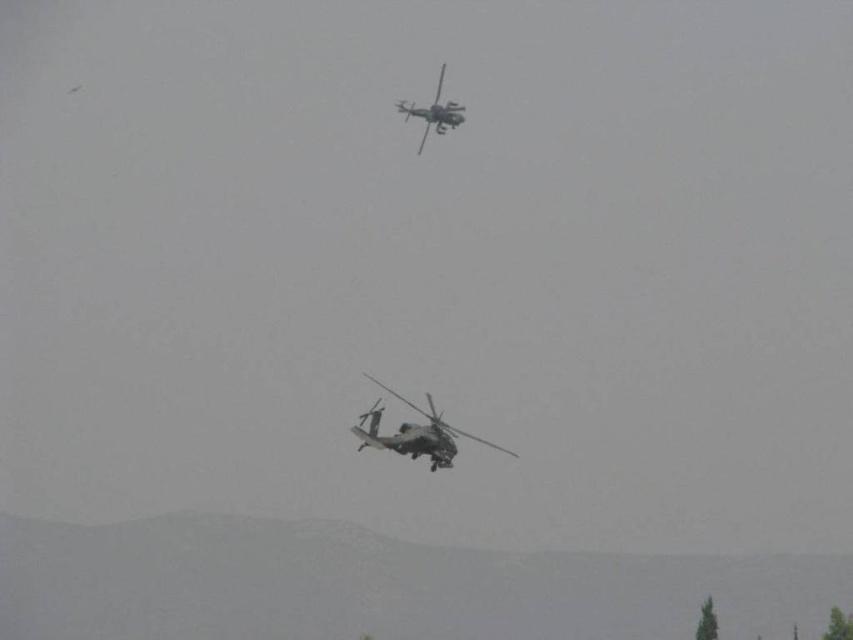
Question: Is metallic gray helicopter at center to the right of camouflage fabric helicopter at upper center from the viewer's perspective?

Choices:
 (A) yes
 (B) no

Answer: (A)

Question: Which point is farther to the camera?

Choices:
 (A) camouflage fabric helicopter at upper center
 (B) metallic gray helicopter at center

Answer: (A)

Question: Considering the relative positions of metallic gray helicopter at center and camouflage fabric helicopter at upper center in the image provided, where is metallic gray helicopter at center located with respect to camouflage fabric helicopter at upper center?

Choices:
 (A) right
 (B) left

Answer: (A)

Question: Does metallic gray helicopter at center have a larger size compared to camouflage fabric helicopter at upper center?

Choices:
 (A) yes
 (B) no

Answer: (B)

Question: Which point is farther to the camera?

Choices:
 (A) camouflage fabric helicopter at upper center
 (B) metallic gray helicopter at center

Answer: (A)